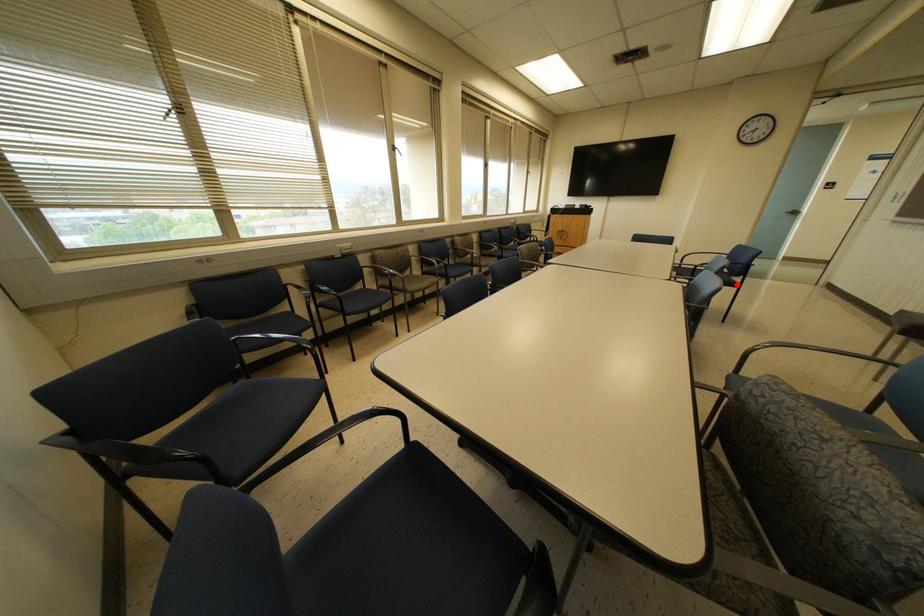
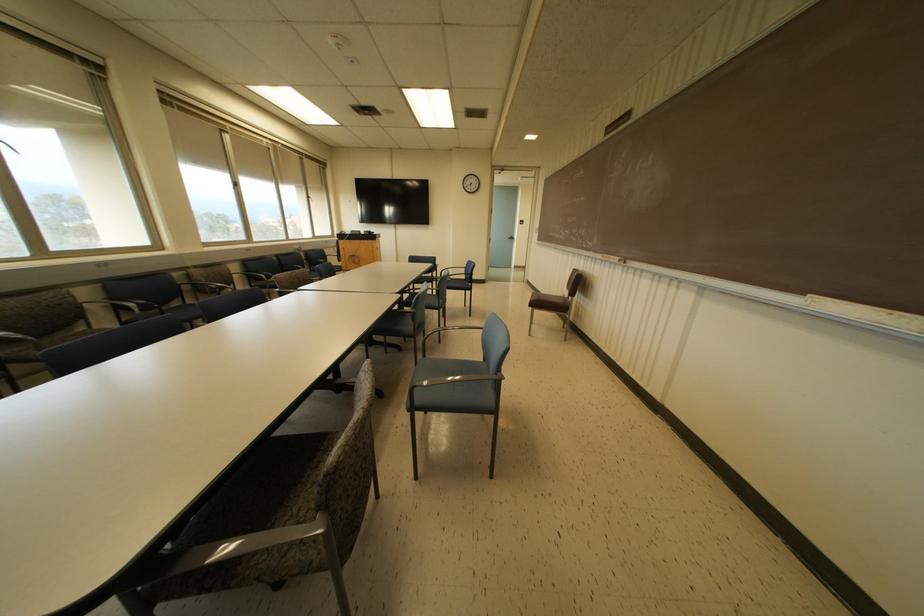
Question: I am providing you with two images of the same scene from different viewpoints. Image1 has a red point marked. In image2, the corresponding 3D location appears at what relative position? Reply with the corresponding letter.

Choices:
 (A) Closer
 (B) Farther

Answer: (A)